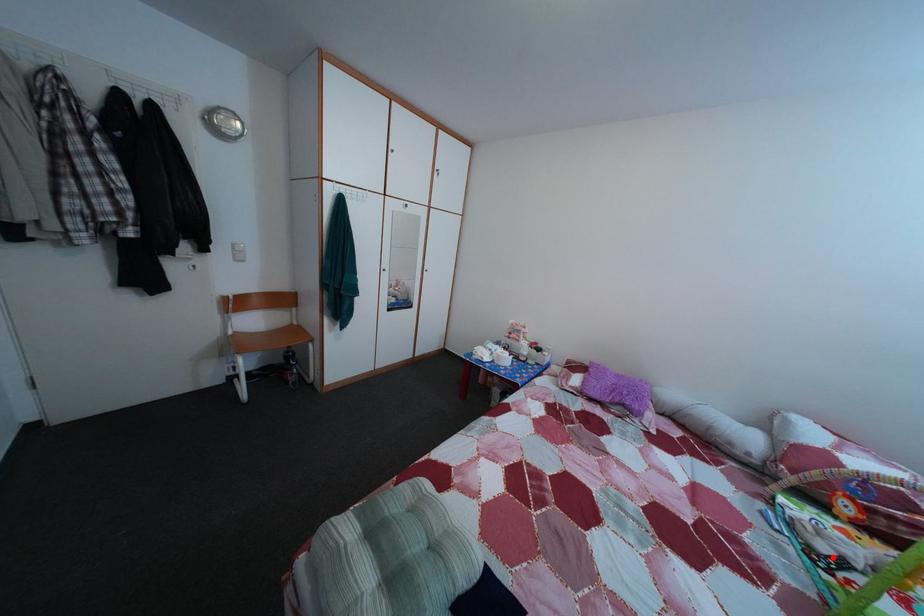
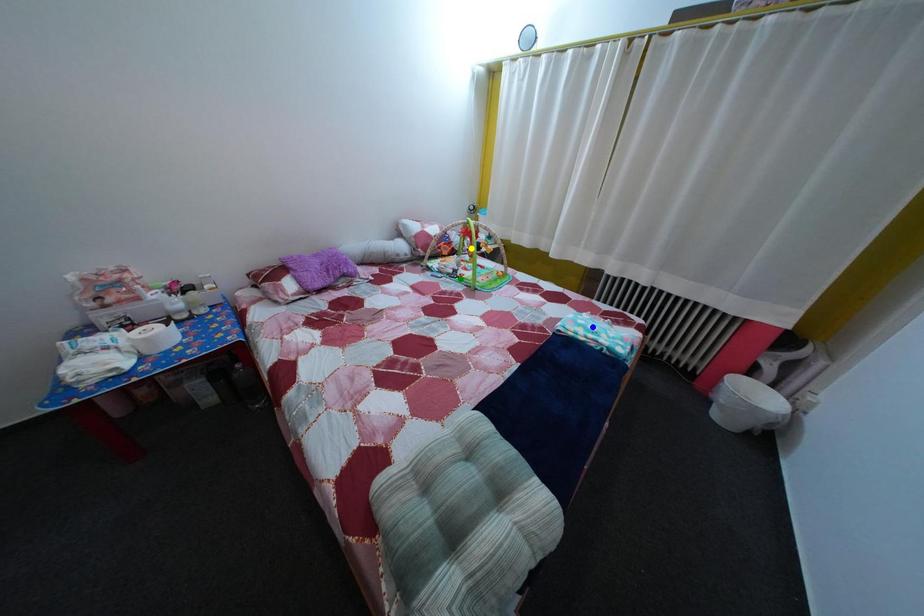
Question: I am providing you with two images of the same scene from different viewpoints. A red point is marked on the first image. You are given multiple points on the second image. In image 2, which mark is for the same physical point as the one in image 1?

Choices:
 (A) green point
 (B) blue point
 (C) yellow point

Answer: (A)